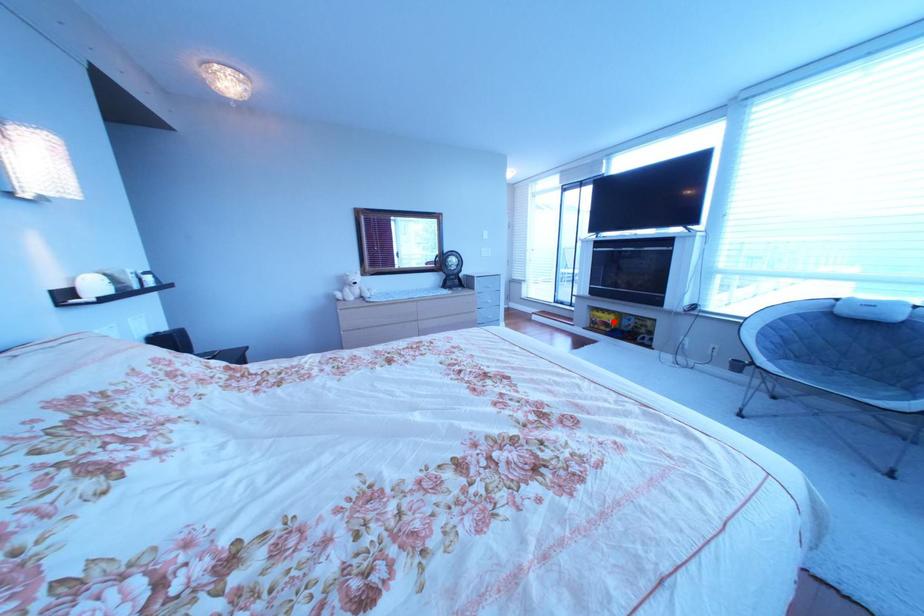
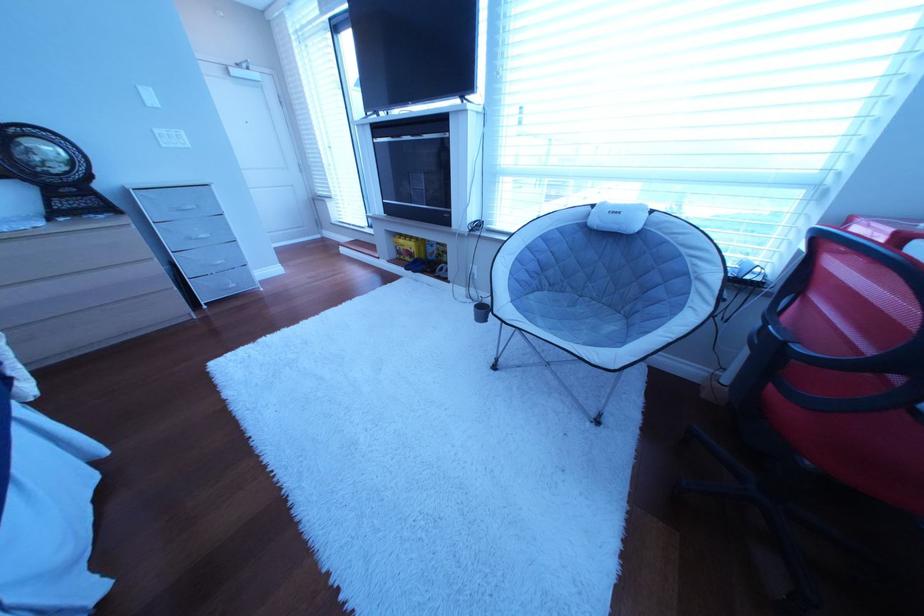
Question: I am providing you with two images of the same scene from different viewpoints. Image1 has a red point marked. In image2, the corresponding 3D location appears at what relative position? Reply with the corresponding letter.

Choices:
 (A) Closer
 (B) Farther

Answer: (A)